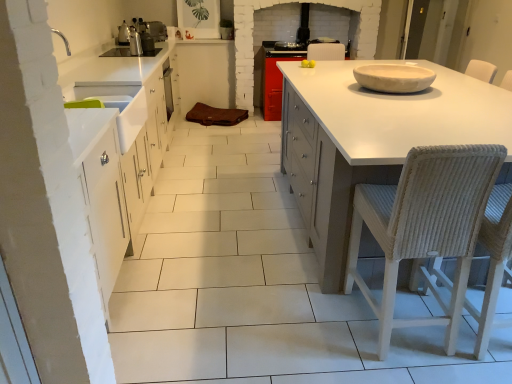
Question: In terms of size, does white ceramic bowl at upper right appear bigger or smaller than woven wicker chair at right, which appears as the second chair when viewed from the right?

Choices:
 (A) big
 (B) small

Answer: (B)

Question: Is white ceramic bowl at upper right in front of or behind woven wicker chair at right, which appears as the second chair when viewed from the right, in the image?

Choices:
 (A) behind
 (B) front

Answer: (A)

Question: Considering the real-world distances, which object is farthest from the white ceramic bowl at upper right?

Choices:
 (A) woven straw chair at right, the 2th chair when ordered from left to right
 (B) metallic stainless steel kettle at upper left
 (C) woven wicker chair at right, arranged as the first chair when viewed from the left
 (D) white matte countertop at center

Answer: (B)

Question: Which is farther from the white ceramic bowl at upper right?

Choices:
 (A) woven wicker chair at right, arranged as the first chair when viewed from the left
 (B) white matte countertop at center
 (C) metallic stainless steel kettle at upper left
 (D) woven straw chair at right, the 2th chair when ordered from left to right

Answer: (C)